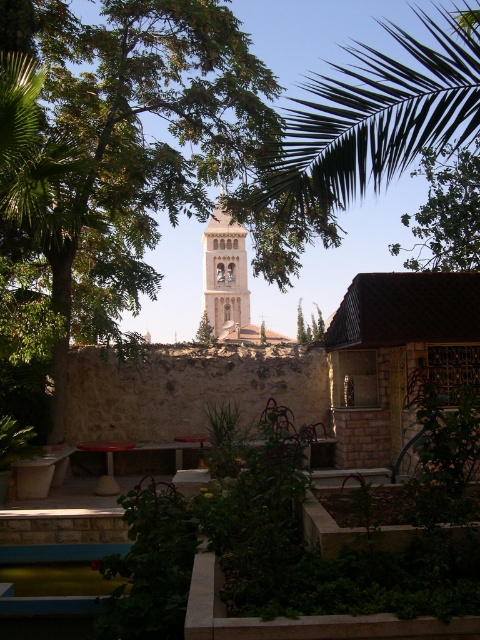
You are planning to install a new garden light in the courtyard. The light requires a clear space above it to function properly. You have two options for placement near the green leafy tree at upper right and the light beige stone bell tower at center. Which location would allow the light to have an unobstructed space above it?

The light beige stone bell tower at center would allow the garden light to have an unobstructed space above it because the green leafy tree at upper right is positioned over the bell tower, meaning the tree is above the tower but not the other way around.

You are a gardener planning to plant a new flower bed between the green leafy tree at upper right and the light beige stone bell tower at center. Based on their positions, which object is closer to the front of the scene where you would start digging?

The green leafy tree at upper right is closer to the front of the scene, so you should start digging near it first.

You are standing in a garden and see the green leafy tree at center and the light beige stone bell tower at center. Which object is higher in the scene?

The green leafy tree at center is above the light beige stone bell tower at center, so the green leafy tree at center is higher in the scene.